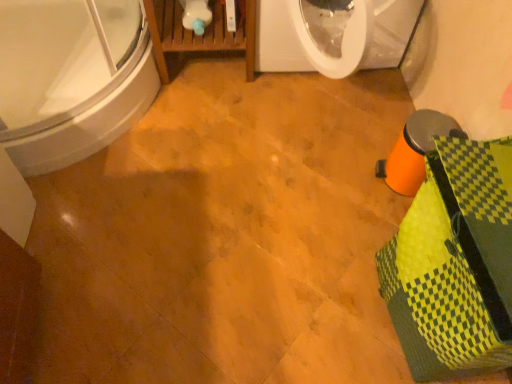
Question: Is yellow-green woven basket at lower right to the right of white glossy bathtub at upper left from the viewer's perspective?

Choices:
 (A) no
 (B) yes

Answer: (B)

Question: Can you confirm if yellow-green woven basket at lower right is taller than white glossy bathtub at upper left?

Choices:
 (A) yes
 (B) no

Answer: (A)

Question: Considering the relative positions of yellow-green woven basket at lower right and white glossy bathtub at upper left in the image provided, is yellow-green woven basket at lower right in front of white glossy bathtub at upper left?

Choices:
 (A) no
 (B) yes

Answer: (B)

Question: Does yellow-green woven basket at lower right have a larger size compared to white glossy bathtub at upper left?

Choices:
 (A) yes
 (B) no

Answer: (B)

Question: From the image's perspective, is yellow-green woven basket at lower right located above white glossy bathtub at upper left?

Choices:
 (A) yes
 (B) no

Answer: (B)

Question: Considering the relative positions of yellow-green woven basket at lower right and white glossy bathtub at upper left in the image provided, is yellow-green woven basket at lower right behind white glossy bathtub at upper left?

Choices:
 (A) no
 (B) yes

Answer: (A)

Question: Considering the relative positions of white glossy bathtub at upper left and yellow-green woven basket at lower right in the image provided, is white glossy bathtub at upper left to the left of yellow-green woven basket at lower right from the viewer's perspective?

Choices:
 (A) yes
 (B) no

Answer: (A)

Question: Is white glossy bathtub at upper left turned away from yellow-green woven basket at lower right?

Choices:
 (A) yes
 (B) no

Answer: (B)

Question: From the image's perspective, does white glossy bathtub at upper left appear lower than yellow-green woven basket at lower right?

Choices:
 (A) yes
 (B) no

Answer: (B)

Question: Is white glossy bathtub at upper left beside yellow-green woven basket at lower right?

Choices:
 (A) no
 (B) yes

Answer: (A)

Question: Does white glossy bathtub at upper left have a lesser height compared to yellow-green woven basket at lower right?

Choices:
 (A) no
 (B) yes

Answer: (B)

Question: Considering the relative sizes of white glossy bathtub at upper left and yellow-green woven basket at lower right in the image provided, is white glossy bathtub at upper left wider than yellow-green woven basket at lower right?

Choices:
 (A) no
 (B) yes

Answer: (B)

Question: Would you say yellow-green woven basket at lower right is inside or outside white glossy bathtub at upper left?

Choices:
 (A) outside
 (B) inside

Answer: (A)